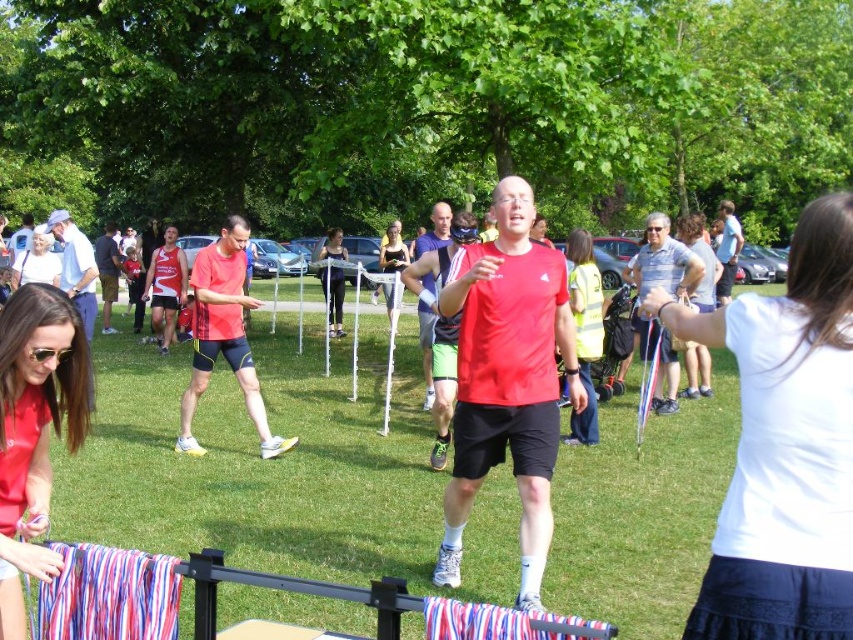
Question: Which of these objects is positioned farthest from the matte red shirt at lower left?

Choices:
 (A) white cotton shirt at upper right
 (B) black mesh tank top at center

Answer: (B)

Question: Is matte red shirt at lower left positioned in front of black mesh tank top at center?

Choices:
 (A) no
 (B) yes

Answer: (B)

Question: Which object is the farthest from the white cotton shirt at upper right?

Choices:
 (A) black mesh tank top at center
 (B) matte red shirt at lower left

Answer: (A)

Question: Among these points, which one is farthest from the camera?

Choices:
 (A) (763, 454)
 (B) (78, 444)

Answer: (B)

Question: In this image, where is white cotton shirt at upper right located relative to black mesh tank top at center?

Choices:
 (A) right
 (B) left

Answer: (A)

Question: Does white cotton shirt at upper right have a larger size compared to black mesh tank top at center?

Choices:
 (A) yes
 (B) no

Answer: (A)